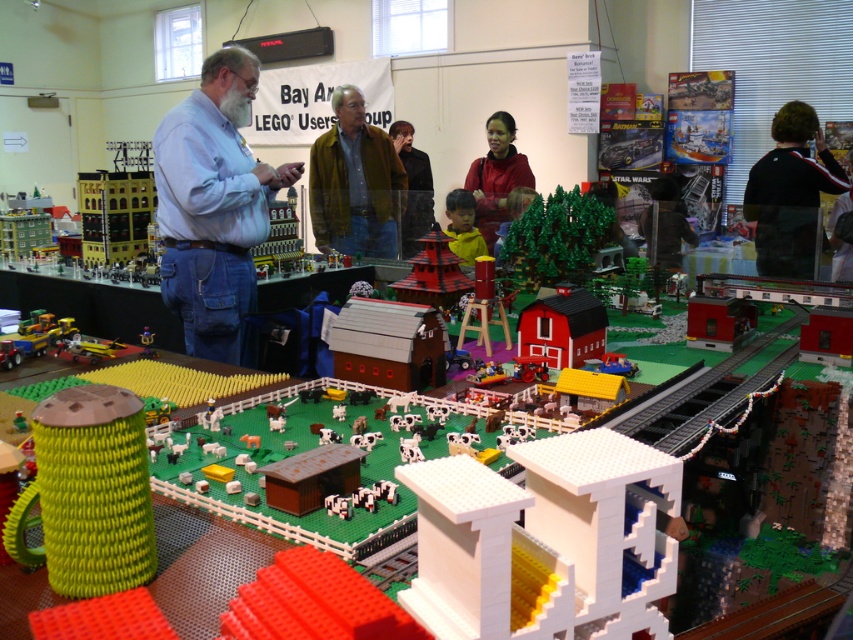
At what (x,y) coordinates should I click in order to perform the action: click on blue shirt at center. Please return your answer as a coordinate pair (x, y). Looking at the image, I should click on (213, 205).

Can you confirm if blue shirt at center is positioned below black fabric at upper right?

Answer: Yes, blue shirt at center is below black fabric at upper right.

The image size is (853, 640). In order to click on blue shirt at center in this screenshot , I will do `click(213, 205)`.

Is brown woolen sweater at center to the left of black fabric at upper right from the viewer's perspective?

Correct, you'll find brown woolen sweater at center to the left of black fabric at upper right.

Is brown woolen sweater at center to the right of black fabric at upper right from the viewer's perspective?

Incorrect, brown woolen sweater at center is not on the right side of black fabric at upper right.

Image resolution: width=853 pixels, height=640 pixels. What do you see at coordinates (354, 182) in the screenshot? I see `brown woolen sweater at center` at bounding box center [354, 182].

I want to click on brown woolen sweater at center, so click(x=354, y=182).

Does point (799, 182) come in front of point (850, 275)?

No, it is behind (850, 275).

Who is lower down, black fabric at upper right or black fabric jacket at upper right?

Positioned lower is black fabric jacket at upper right.

Does point (781, 115) come in front of point (849, 157)?

Yes, it is in front of point (849, 157).

This screenshot has width=853, height=640. What are the coordinates of `black fabric at upper right` in the screenshot? It's located at (790, 193).